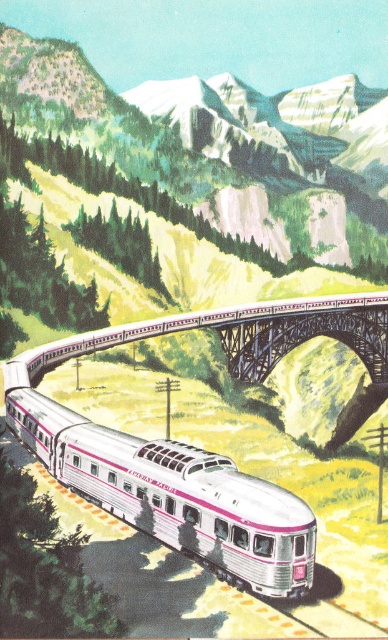
Question: Is silver polished metal train at center further to the viewer compared to metallic gray bridge at center?

Choices:
 (A) yes
 (B) no

Answer: (B)

Question: Is silver polished metal train at center bigger than metallic gray bridge at center?

Choices:
 (A) no
 (B) yes

Answer: (A)

Question: Which point is closer to the camera taking this photo?

Choices:
 (A) (384, 349)
 (B) (202, 524)

Answer: (B)

Question: Does silver polished metal train at center appear under metallic gray bridge at center?

Choices:
 (A) no
 (B) yes

Answer: (B)